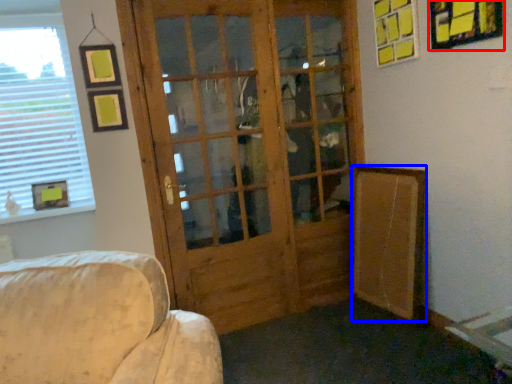
Question: Among these objects, which one is farthest to the camera, picture frame (highlighted by a red box) or bulletin board (highlighted by a blue box)?

Choices:
 (A) picture frame
 (B) bulletin board

Answer: (B)